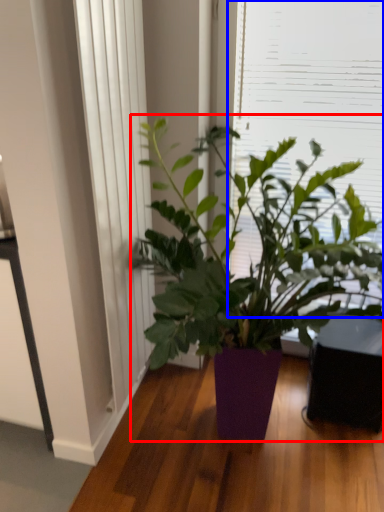
Question: Which of the following is the farthest to the observer, houseplant (highlighted by a red box) or window screen (highlighted by a blue box)?

Choices:
 (A) houseplant
 (B) window screen

Answer: (B)